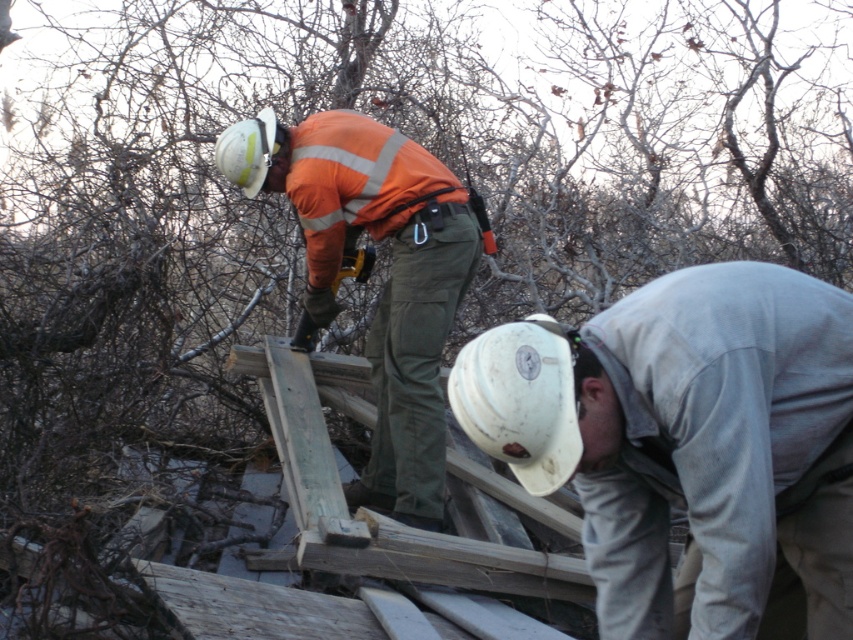
Based on the photo, can you confirm if white matte hard hat at lower center is thinner than orange reflective jacket at center?

Correct, white matte hard hat at lower center's width is less than orange reflective jacket at center's.

Who is more distant from viewer, (x=479, y=445) or (x=422, y=268)?

Point (x=422, y=268)

Does point (718, 394) come farther from viewer compared to point (374, 144)?

No, (718, 394) is in front of (374, 144).

At what (x,y) coordinates should I click in order to perform the action: click on white matte hard hat at lower center. Please return your answer as a coordinate pair (x, y). The image size is (853, 640). Looking at the image, I should click on (670, 428).